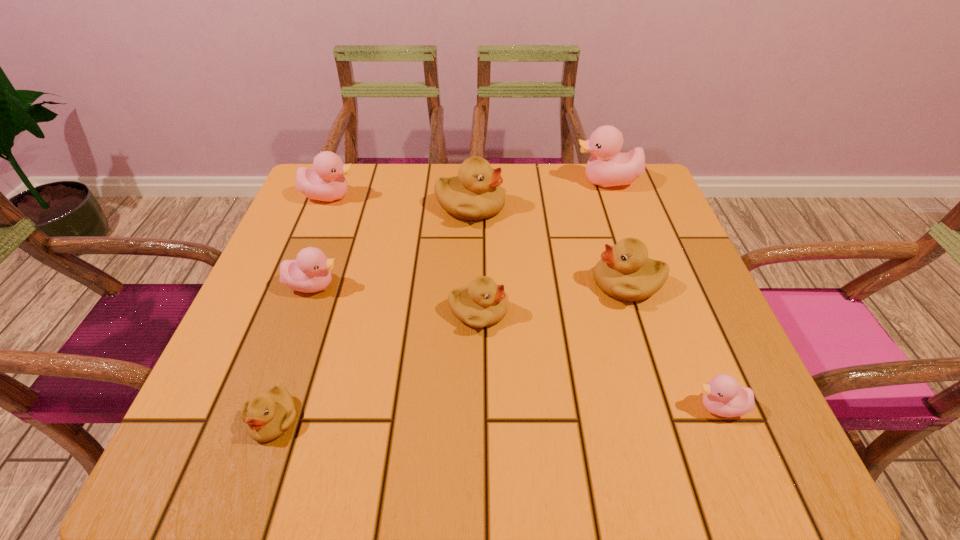
This screenshot has width=960, height=540. What are the coordinates of `object that ranks as the third closest to the smallest pink duckling` in the screenshot? It's located at (474, 194).

I want to click on duckling that is the fourth nearest to the second biggest pink duckling, so click(267, 416).

The image size is (960, 540). Find the location of `the third closest duckling to the biggest yellow duckling`. the third closest duckling to the biggest yellow duckling is located at coordinates (625, 272).

Find the location of a particular element. This screenshot has height=540, width=960. the second closest pink duckling to the biggest pink duckling is located at coordinates (722, 396).

Identify which pink duckling is the closest to the second smallest pink duckling. Please provide its 2D coordinates. Your answer should be formatted as a tuple, i.e. [(x, y)], where the tuple contains the x and y coordinates of a point satisfying the conditions above.

[(326, 182)]

Select which yellow duckling is the second closest to the farthest yellow duckling. Please provide its 2D coordinates. Your answer should be formatted as a tuple, i.e. [(x, y)], where the tuple contains the x and y coordinates of a point satisfying the conditions above.

[(625, 272)]

Identify which yellow duckling is the third closest to the biggest yellow duckling. Please provide its 2D coordinates. Your answer should be formatted as a tuple, i.e. [(x, y)], where the tuple contains the x and y coordinates of a point satisfying the conditions above.

[(267, 416)]

Where is `free location that satisfies the following two spatial constraints: 1. on the front-facing side of the farthest yellow duckling; 2. on the front-facing side of the leftmost yellow duckling`? free location that satisfies the following two spatial constraints: 1. on the front-facing side of the farthest yellow duckling; 2. on the front-facing side of the leftmost yellow duckling is located at coordinates (465, 418).